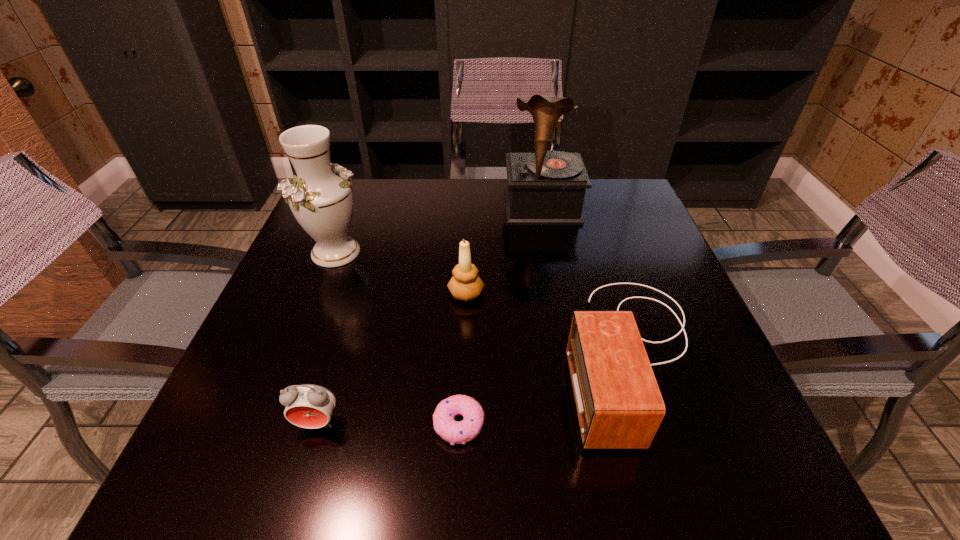
The height and width of the screenshot is (540, 960). I want to click on unoccupied position between the phonograph_record and the doughnut, so click(x=500, y=316).

Locate an element on the screen. The width and height of the screenshot is (960, 540). empty location between the vase and the shortest object is located at coordinates (397, 338).

Locate an element on the screen. vacant area that lies between the candle_holder and the phonograph_record is located at coordinates (504, 251).

Image resolution: width=960 pixels, height=540 pixels. What are the coordinates of `free spot between the shortest object and the alarm clock` in the screenshot? It's located at (388, 423).

Image resolution: width=960 pixels, height=540 pixels. Identify the location of vacant point located between the farthest object and the radio receiver. (588, 281).

The width and height of the screenshot is (960, 540). I want to click on free space between the vase and the farthest object, so click(x=439, y=230).

You are a GUI agent. You are given a task and a screenshot of the screen. Output one action in this format:
    pyautogui.click(x=<x>, y=<y>)
    Task: Click on the object that stands as the third closest to the vase
    
    Given the screenshot: What is the action you would take?
    pyautogui.click(x=310, y=406)

In order to click on object identified as the closest to the candle_holder in this screenshot , I will do `click(618, 403)`.

The height and width of the screenshot is (540, 960). I want to click on free space that satisfies the following two spatial constraints: 1. on the face of the alarm clock; 2. on the left side of the doughnut, so click(x=317, y=424).